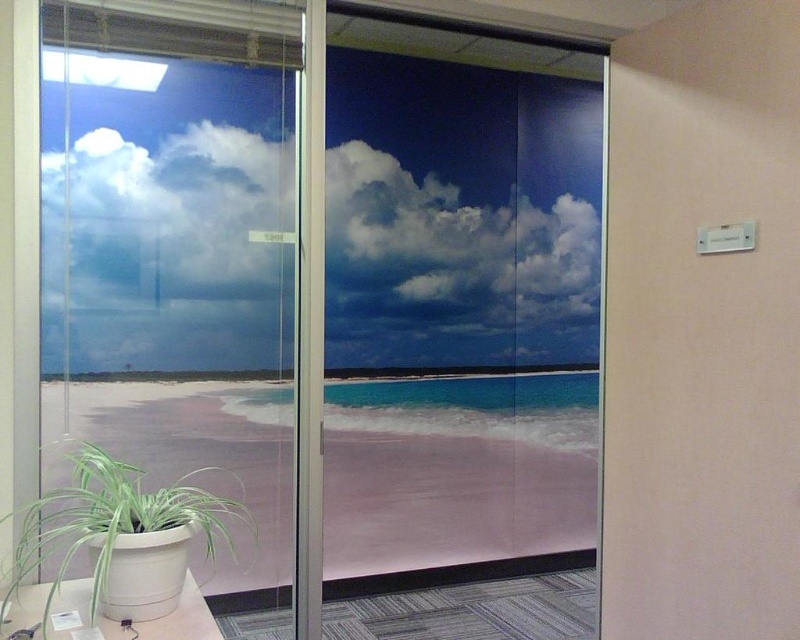
You are standing in the office and looking at the glass partition with the beach mural. There are two points marked on the partition at coordinates point (392, 128) and point (218, 468). Which point is closer to you?

Point (218, 468) is closer to you because it is nearer to the camera compared to point (392, 128), which is further away.

You are an office worker sitting at your desk and looking at the white fluffy cloud at upper center and the green leafy plant at lower left. Which object is closer to you?

The green leafy plant at lower left is closer to you because it is behind the white fluffy cloud at upper center, so the cloud is farther away.